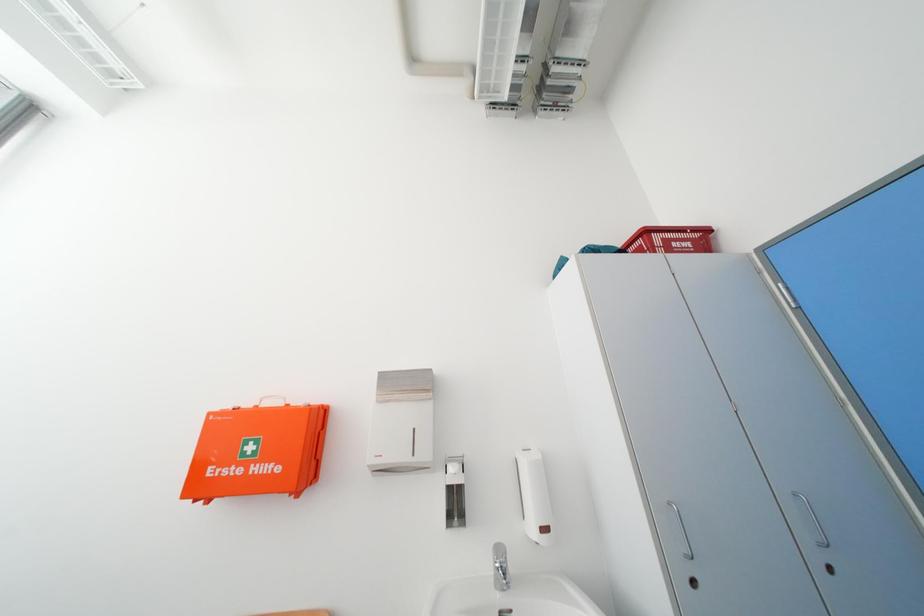
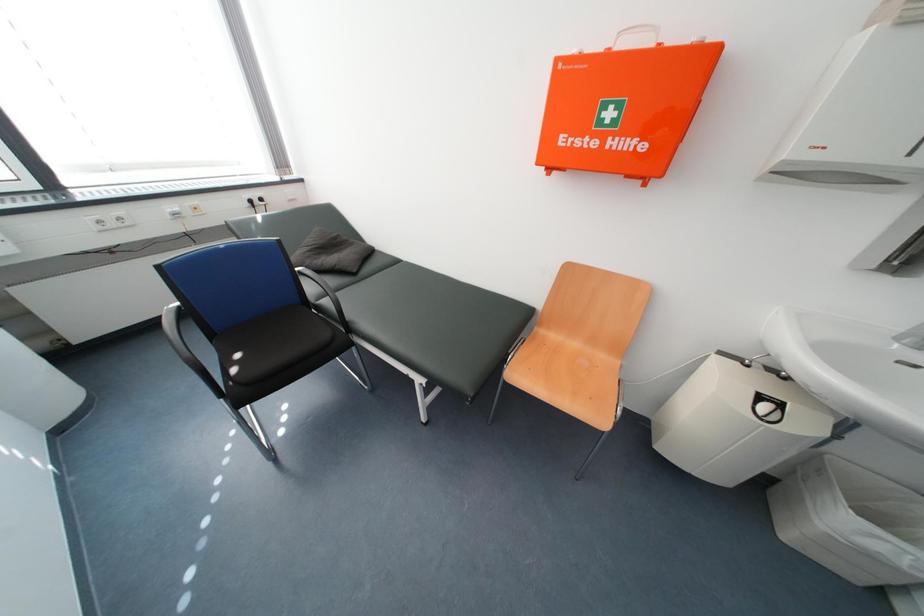
First-person continuous shooting, in which direction is the camera rotating?

The rotation direction of the camera is left-down.